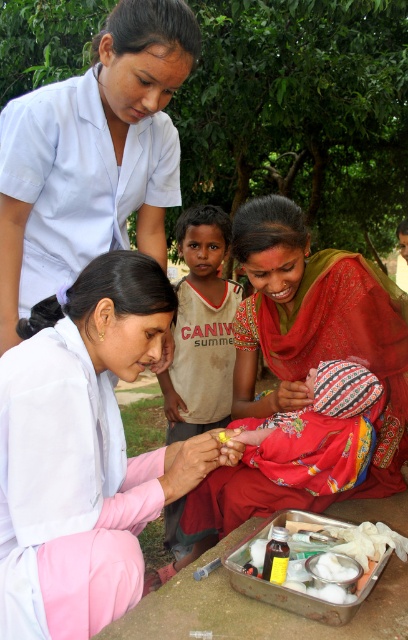
Based on the photo, you are a drone operator trying to capture a photo of the two points in the image. The first point is at coordinate point [299,497] and the second is at point [170,394]. Which point should you focus on first to ensure both are in frame?

Point [299,497] is closer to the viewer than point [170,394], so you should focus on point [299,497] first to ensure both are in frame.

You are a photographer trying to capture a clear photo of the white uniform at upper left and the white cotton shirt at center. However, you notice that one of them is blocking the view of the other. Which object is covering part of the other?

The white uniform at upper left is positioned over the white cotton shirt at center, so the white uniform at upper left is covering part of the white cotton shirt at center.

You are a photographer standing at the camera position. You want to take a photo of the matte red sari at center without moving the camera. Can you fit the entire sari into the photo frame?

The matte red sari at center and camera are 6.52 feet apart from each other. Since the distance is within the camera frame, the entire sari can be captured in the photo.